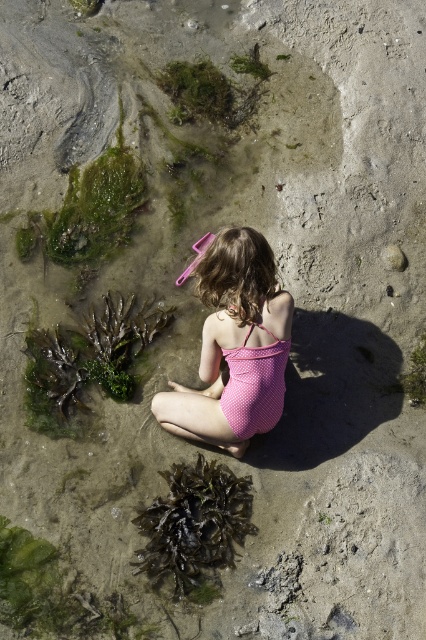
Does pink polka dot swimsuit at center appear on the right side of green mossy algae at lower left?

Indeed, pink polka dot swimsuit at center is positioned on the right side of green mossy algae at lower left.

Is point (218, 435) in front of point (115, 310)?

Yes, point (218, 435) is in front of point (115, 310).

This screenshot has height=640, width=426. What are the coordinates of `pink polka dot swimsuit at center` in the screenshot? It's located at (233, 342).

Looking at this image, who is more distant from viewer, (204, 339) or (218, 531)?

The point (218, 531) is more distant.

At what (x,y) coordinates should I click in order to perform the action: click on pink polka dot swimsuit at center. Please return your answer as a coordinate pair (x, y). The height and width of the screenshot is (640, 426). Looking at the image, I should click on (233, 342).

Which of these two, green mossy algae at lower left or dark green seaweed at lower left, stands shorter?

dark green seaweed at lower left

Is green mossy algae at lower left shorter than dark green seaweed at lower left?

In fact, green mossy algae at lower left may be taller than dark green seaweed at lower left.

Is point (55, 349) more distant than point (146, 547)?

Yes, point (55, 349) is behind point (146, 547).

The height and width of the screenshot is (640, 426). I want to click on green mossy algae at lower left, so click(x=86, y=362).